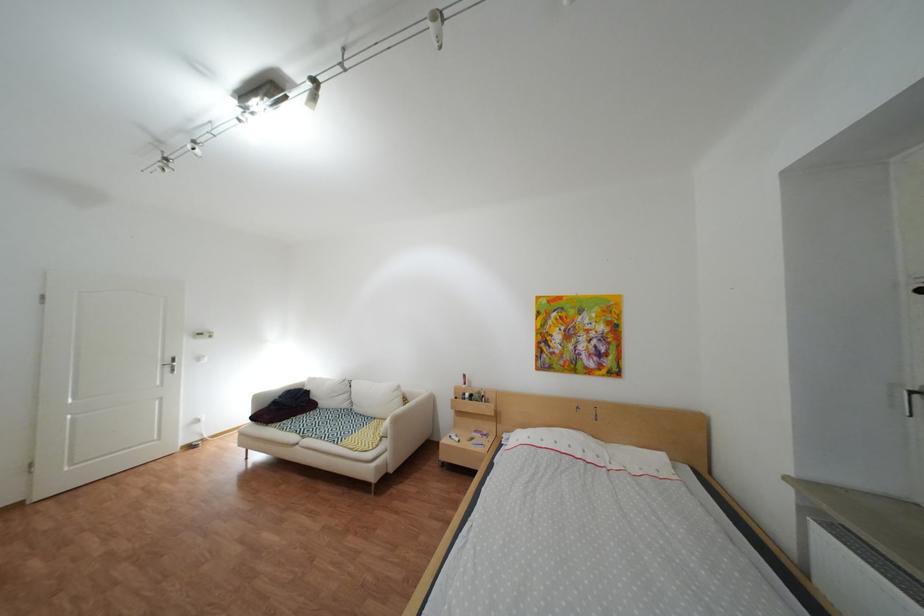
Find where to rest the white sofa armrest. Please return your answer as a coordinate pair (x, y).

(415, 407)